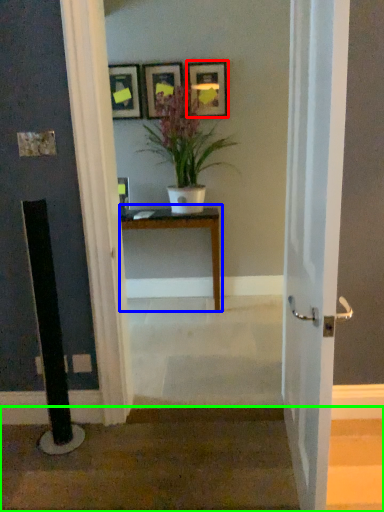
Question: Which object is the closest to the picture frame (highlighted by a red box)? Choose among these: table (highlighted by a blue box) or stairwell (highlighted by a green box).

Choices:
 (A) table
 (B) stairwell

Answer: (A)